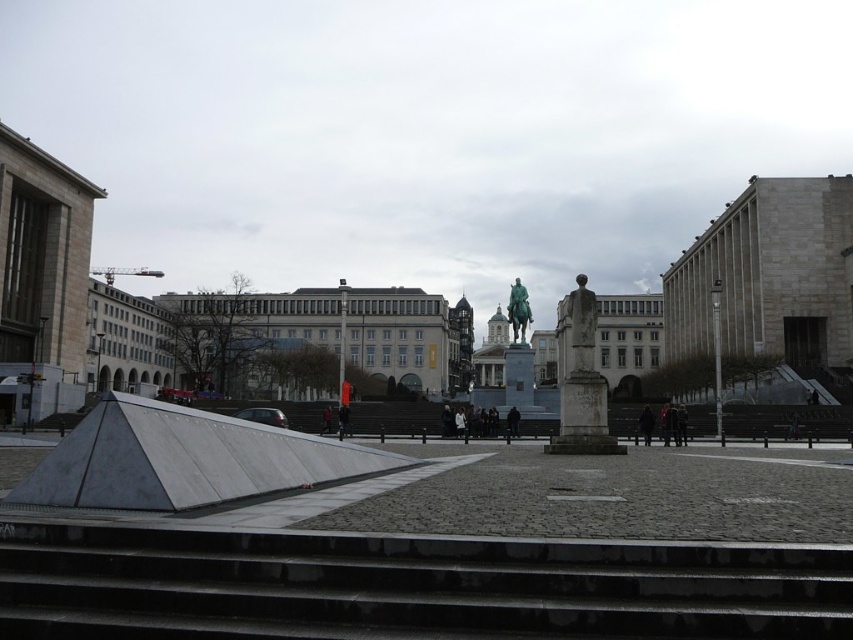
You are a tourist in the public square and want to take a photo of both the white stone statue at center and the gold polished statue at center. From your current position, which statue is blocking the view of the other?

The white stone statue at center is in front of the gold polished statue at center, so it is blocking the view of the gold polished statue at center.

You are a tourist in the public square and want to take a photo of the bronze statue at center and the gold polished statue at center. Which one should you focus on first to ensure both are in the frame?

The bronze statue at center is in front of the gold polished statue at center, so you should focus on the bronze statue at center first to ensure both are in the frame.

You are a tour guide leading a group in the public square. You want to inform your group about the distance between the white stone statue at center and the gold polished statue at center. What do you tell them?

The white stone statue at center is 73.10 meters away from the gold polished statue at center.